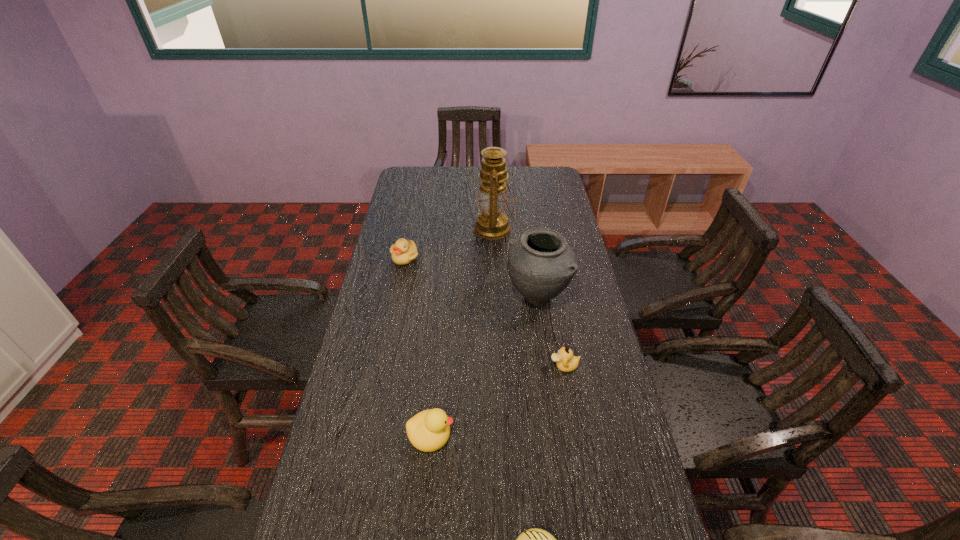
Locate an element on the screen. The width and height of the screenshot is (960, 540). duckling object that ranks as the closest to the nearest object is located at coordinates (429, 430).

Select which duckling appears as the second closest to the tallest object. Please provide its 2D coordinates. Your answer should be formatted as a tuple, i.e. [(x, y)], where the tuple contains the x and y coordinates of a point satisfying the conditions above.

[(565, 361)]